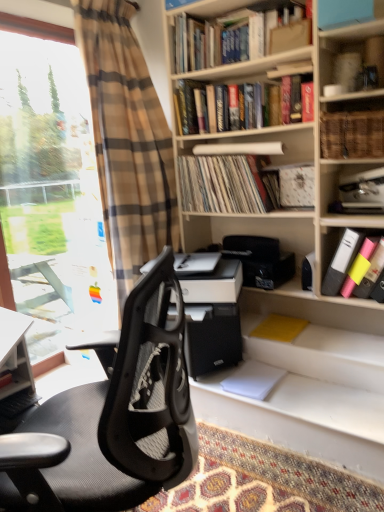
Question: Is matte plastic folders at right, the first book ordered from the bottom, positioned beyond the bounds of woven wicker basket at upper right, which appears as the 3th book when viewed from the top?

Choices:
 (A) no
 (B) yes

Answer: (B)

Question: Does matte plastic folders at right, the sixth book viewed from the top, have a greater width compared to woven wicker basket at upper right, which appears as the 3th book when viewed from the top?

Choices:
 (A) yes
 (B) no

Answer: (A)

Question: Considering the relative sizes of matte plastic folders at right, the sixth book viewed from the top, and woven wicker basket at upper right, positioned as the 4th book in bottom-to-top order, in the image provided, is matte plastic folders at right, the sixth book viewed from the top, taller than woven wicker basket at upper right, positioned as the 4th book in bottom-to-top order,?

Choices:
 (A) yes
 (B) no

Answer: (A)

Question: Can you confirm if matte plastic folders at right, the first book ordered from the bottom, is bigger than woven wicker basket at upper right, which appears as the 3th book when viewed from the top?

Choices:
 (A) no
 (B) yes

Answer: (B)

Question: From a real-world perspective, is matte plastic folders at right, the first book ordered from the bottom, physically below woven wicker basket at upper right, positioned as the 4th book in bottom-to-top order?

Choices:
 (A) yes
 (B) no

Answer: (A)

Question: Considering the relative sizes of matte plastic folders at right, the sixth book viewed from the top, and woven wicker basket at upper right, which appears as the 3th book when viewed from the top, in the image provided, is matte plastic folders at right, the sixth book viewed from the top, thinner than woven wicker basket at upper right, which appears as the 3th book when viewed from the top,?

Choices:
 (A) no
 (B) yes

Answer: (A)

Question: From the image's perspective, is woven wicker basket at upper right, positioned as the 4th book in bottom-to-top order, located beneath white matte printer at center?

Choices:
 (A) yes
 (B) no

Answer: (B)

Question: Is woven wicker basket at upper right, positioned as the 4th book in bottom-to-top order, outside white matte printer at center?

Choices:
 (A) yes
 (B) no

Answer: (A)

Question: Is white matte printer at center surrounded by woven wicker basket at upper right, which appears as the 3th book when viewed from the top?

Choices:
 (A) no
 (B) yes

Answer: (A)

Question: Can you confirm if woven wicker basket at upper right, positioned as the 4th book in bottom-to-top order, is taller than white matte printer at center?

Choices:
 (A) yes
 (B) no

Answer: (B)

Question: Considering the relative sizes of woven wicker basket at upper right, which appears as the 3th book when viewed from the top, and white matte printer at center in the image provided, is woven wicker basket at upper right, which appears as the 3th book when viewed from the top, bigger than white matte printer at center?

Choices:
 (A) no
 (B) yes

Answer: (A)

Question: Considering the relative positions of woven wicker basket at upper right, positioned as the 4th book in bottom-to-top order, and white matte printer at center in the image provided, is woven wicker basket at upper right, positioned as the 4th book in bottom-to-top order, to the right of white matte printer at center from the viewer's perspective?

Choices:
 (A) yes
 (B) no

Answer: (A)

Question: Is patterned carpet at lower center outside black mesh office chair at left?

Choices:
 (A) yes
 (B) no

Answer: (A)